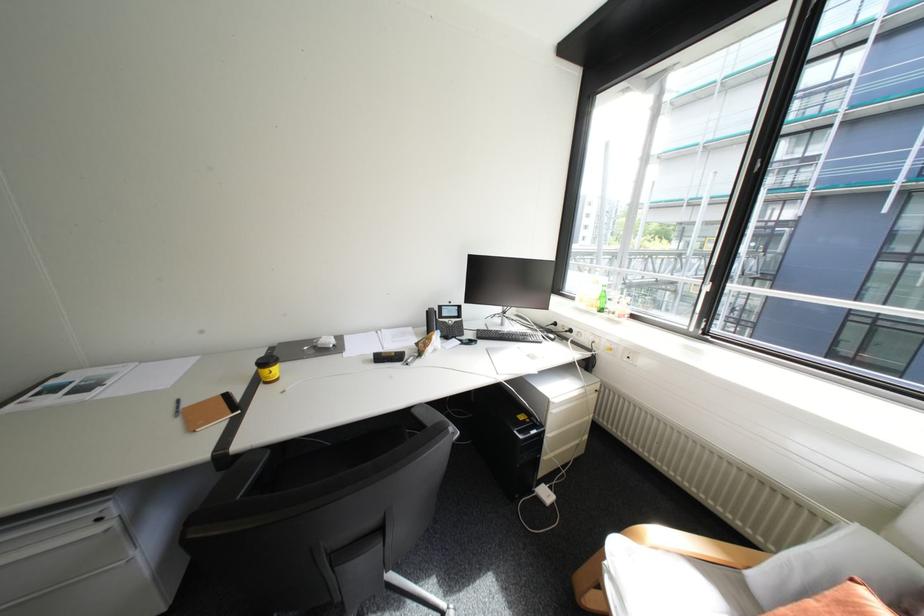
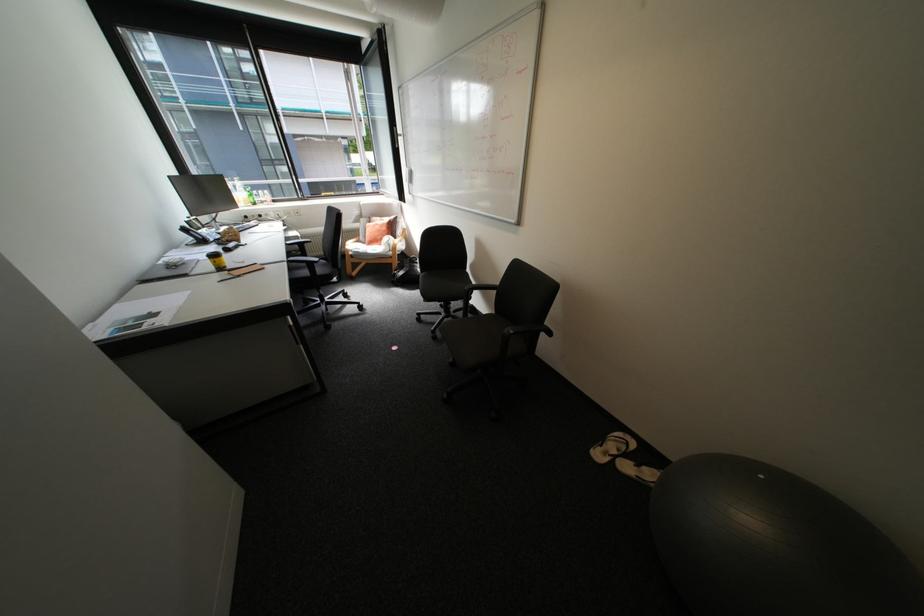
The point at (598, 306) is marked in the first image. Where is the corresponding point in the second image?

(256, 204)